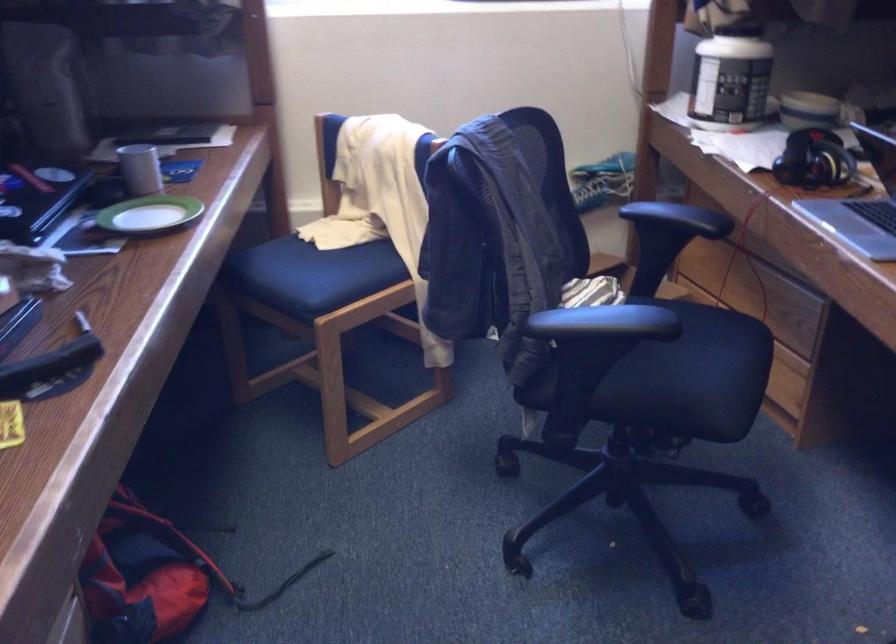
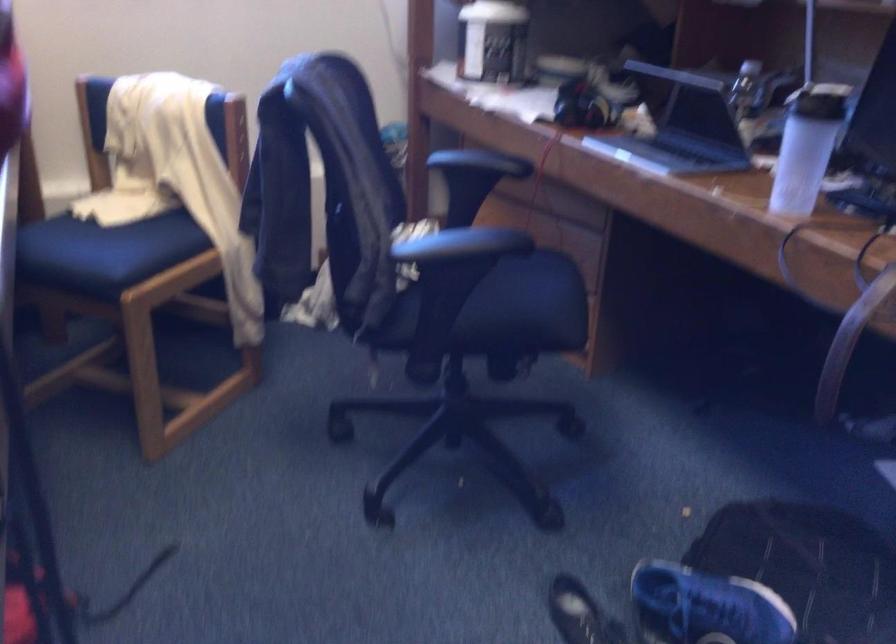
Question: The images are taken continuously from a first-person perspective. In which direction are you moving?

Choices:
 (A) Left
 (B) Right
 (C) Forward
 (D) Backward

Answer: (A)